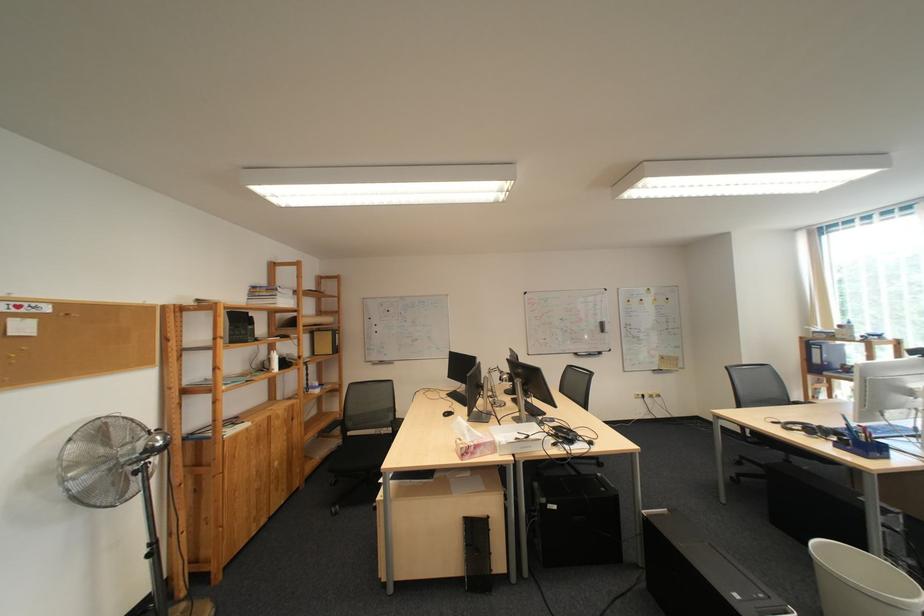
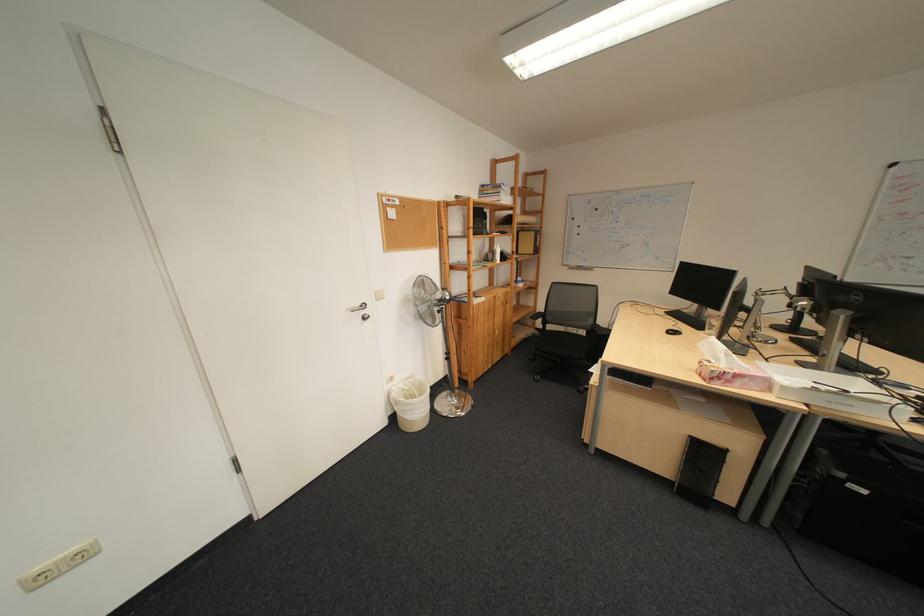
In the second image, find the point that corresponds to [528,456] in the first image.

(821, 407)